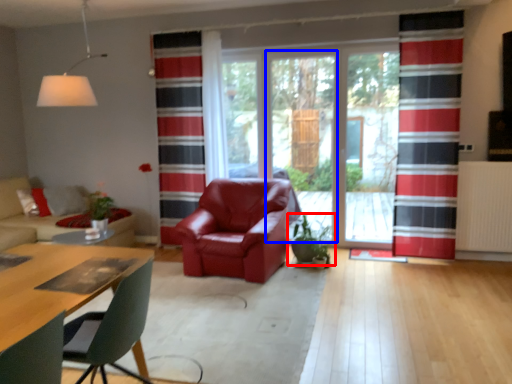
Question: Which object appears farthest to the camera in this image, houseplant (highlighted by a red box) or screen door (highlighted by a blue box)?

Choices:
 (A) houseplant
 (B) screen door

Answer: (B)